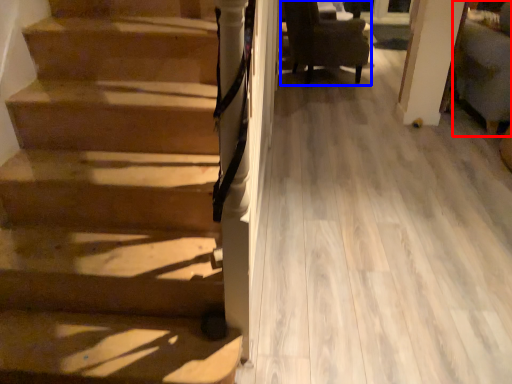
Question: Among these objects, which one is farthest to the camera, armchair (highlighted by a red box) or chair (highlighted by a blue box)?

Choices:
 (A) armchair
 (B) chair

Answer: (B)